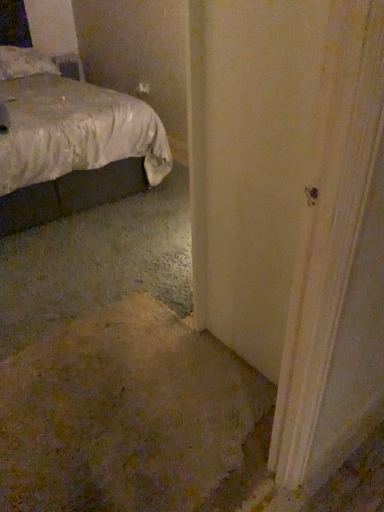
Locate an element on the screen. This screenshot has width=384, height=512. white fabric bed at upper left is located at coordinates pyautogui.click(x=69, y=142).

What do you see at coordinates (69, 142) in the screenshot? The width and height of the screenshot is (384, 512). I see `white fabric bed at upper left` at bounding box center [69, 142].

What is the approximate height of white fabric pillow at upper left?

It is 11.16 inches.

This screenshot has width=384, height=512. Describe the element at coordinates (24, 63) in the screenshot. I see `white fabric pillow at upper left` at that location.

Where is `white fabric pillow at upper left`? Image resolution: width=384 pixels, height=512 pixels. white fabric pillow at upper left is located at coordinates (24, 63).

Where is `white fabric bed at upper left`? The height and width of the screenshot is (512, 384). white fabric bed at upper left is located at coordinates (69, 142).

Which is more to the right, white fabric pillow at upper left or white fabric bed at upper left?

white fabric bed at upper left.

Which object is closer to the camera taking this photo, white fabric pillow at upper left or white fabric bed at upper left?

Positioned in front is white fabric bed at upper left.

Considering the points (51, 60) and (41, 163), which point is behind, point (51, 60) or point (41, 163)?

The point (51, 60) is farther.

From the image's perspective, would you say white fabric pillow at upper left is positioned over white fabric bed at upper left?

Indeed, from the image's perspective, white fabric pillow at upper left is shown above white fabric bed at upper left.

From a real-world perspective, is white fabric pillow at upper left above or below white fabric bed at upper left?

Clearly, from a real-world perspective, white fabric pillow at upper left is above white fabric bed at upper left.

Which object is thinner, white fabric pillow at upper left or white fabric bed at upper left?

white fabric pillow at upper left.

Does white fabric pillow at upper left have a lesser height compared to white fabric bed at upper left?

Indeed, white fabric pillow at upper left has a lesser height compared to white fabric bed at upper left.

Considering the relative sizes of white fabric pillow at upper left and white fabric bed at upper left in the image provided, is white fabric pillow at upper left bigger than white fabric bed at upper left?

Incorrect, white fabric pillow at upper left is not larger than white fabric bed at upper left.

Is white fabric bed at upper left surrounded by white fabric pillow at upper left?

No, white fabric pillow at upper left does not contain white fabric bed at upper left.

In the scene shown: Is white fabric pillow at upper left far away from white fabric bed at upper left?

No.

Is white fabric pillow at upper left aimed at white fabric bed at upper left?

Yes.

How different are the orientations of white fabric pillow at upper left and white fabric bed at upper left in degrees?

They differ by 0.418 degrees in their facing directions.

You are a GUI agent. You are given a task and a screenshot of the screen. Output one action in this format:
    pyautogui.click(x=<x>, y=<y>)
    Task: Click on the pillow behind the white fabric bed at upper left
    This screenshot has width=384, height=512.
    Given the screenshot: What is the action you would take?
    pyautogui.click(x=24, y=63)

Based on the photo, which object is positioned more to the right, white fabric bed at upper left or white fabric pillow at upper left?

white fabric bed at upper left.

Considering their positions, is white fabric bed at upper left located in front of or behind white fabric pillow at upper left?

In the image, white fabric bed at upper left appears in front of white fabric pillow at upper left.

Is point (119, 166) behind point (44, 59)?

No, it is in front of (44, 59).

From the image's perspective, is white fabric bed at upper left below white fabric pillow at upper left?

Yes, from the image's perspective, white fabric bed at upper left is beneath white fabric pillow at upper left.

In the scene shown: From a real-world perspective, does white fabric bed at upper left sit lower than white fabric pillow at upper left?

Yes, from a real-world perspective, white fabric bed at upper left is beneath white fabric pillow at upper left.

Considering the sizes of objects white fabric bed at upper left and white fabric pillow at upper left in the image provided, who is wider, white fabric bed at upper left or white fabric pillow at upper left?

With larger width is white fabric bed at upper left.

Who is taller, white fabric bed at upper left or white fabric pillow at upper left?

white fabric bed at upper left.

Considering the sizes of white fabric bed at upper left and white fabric pillow at upper left in the image, is white fabric bed at upper left bigger or smaller than white fabric pillow at upper left?

Considering their sizes, white fabric bed at upper left takes up more space than white fabric pillow at upper left.

Is white fabric bed at upper left surrounding white fabric pillow at upper left?

Yes, white fabric pillow at upper left can be found within white fabric bed at upper left.

Is white fabric bed at upper left placed right next to white fabric pillow at upper left?

No.

Is white fabric bed at upper left turned away from white fabric pillow at upper left?

Absolutely, white fabric bed at upper left is directed away from white fabric pillow at upper left.

What's the angular difference between white fabric bed at upper left and white fabric pillow at upper left's facing directions?

The angular difference between white fabric bed at upper left and white fabric pillow at upper left is 0.418 degrees.

Measure the distance from white fabric bed at upper left to white fabric pillow at upper left.

A distance of 22.51 inches exists between white fabric bed at upper left and white fabric pillow at upper left.

Find the location of a particular element. This screenshot has width=384, height=512. bed in front of the white fabric pillow at upper left is located at coordinates (69, 142).

Find the location of a particular element. The image size is (384, 512). pillow on the left of white fabric bed at upper left is located at coordinates (24, 63).

The image size is (384, 512). In order to click on pillow above the white fabric bed at upper left (from a real-world perspective) in this screenshot , I will do `click(24, 63)`.